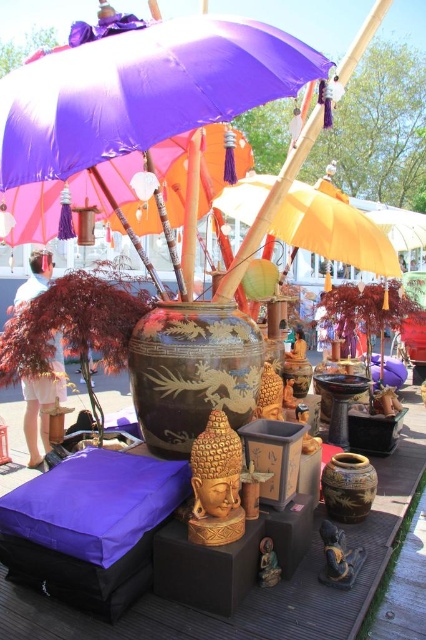
Based on the photo, which of these two, black glossy vase at center or brown textured vase at center, stands shorter?

With less height is brown textured vase at center.

Is black glossy vase at center thinner than brown textured vase at center?

No, black glossy vase at center is not thinner than brown textured vase at center.

Measure the distance between point (221, 353) and camera.

A distance of 10.62 feet exists between point (221, 353) and camera.

Identify the location of black glossy vase at center. The width and height of the screenshot is (426, 640). (192, 371).

How far apart are purple fabric umbrella at upper center and black glossy vase at center?

purple fabric umbrella at upper center is 1.63 meters from black glossy vase at center.

Can you confirm if purple fabric umbrella at upper center is bigger than black glossy vase at center?

Indeed, purple fabric umbrella at upper center has a larger size compared to black glossy vase at center.

Which is in front, point (226, 28) or point (180, 445)?

Positioned in front is point (226, 28).

Where is `purple fabric umbrella at upper center`? purple fabric umbrella at upper center is located at coordinates pyautogui.click(x=141, y=90).

Which is more to the right, purple fabric umbrella at upper center or brown textured vase at center?

brown textured vase at center

Between point (210, 65) and point (348, 480), which one is positioned in front?

Positioned in front is point (210, 65).

You are a GUI agent. You are given a task and a screenshot of the screen. Output one action in this format:
    pyautogui.click(x=<x>, y=<y>)
    Task: Click on the purple fabric umbrella at upper center
    Image resolution: width=426 pixels, height=640 pixels.
    Given the screenshot: What is the action you would take?
    pyautogui.click(x=141, y=90)